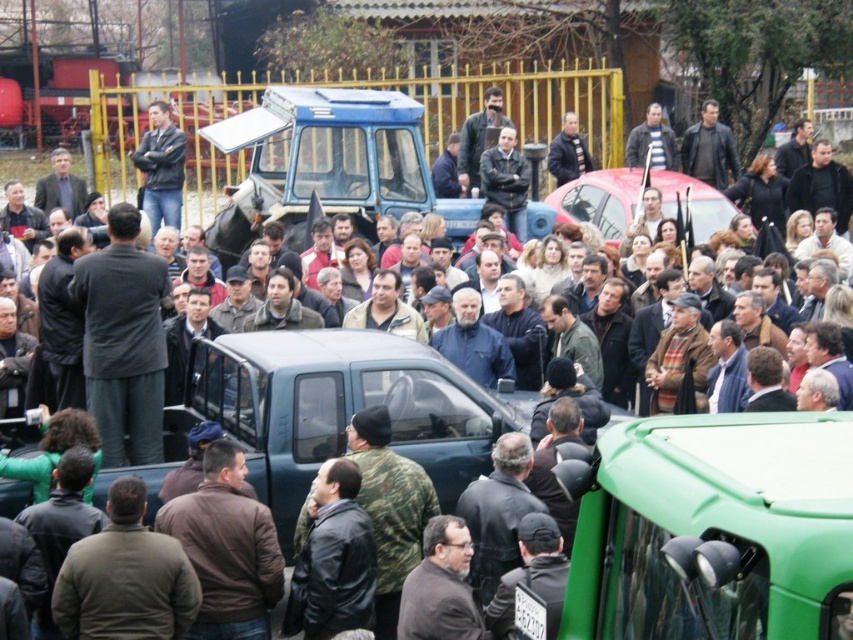
You are a photographer trying to capture both the dark brown leather jacket at upper center and the dark blue jacket at center in a single shot. Since you want to ensure both are in focus, which jacket should you prioritize focusing on first?

You should prioritize focusing on the dark brown leather jacket at upper center first because it is closer to the viewer than the dark blue jacket at center, so adjusting focus from near to far will help both be in focus.

You are standing at the point with coordinates (x=506, y=180) in the image. What object are you currently standing on?

The point at (x=506, y=180) is located on the dark brown leather jacket at center.

You are a photographer trying to capture a clear shot of the dark brown leather jacket at center and the dark brown leather jacket at upper center in the crowded scene. Which jacket should you focus on first to ensure it appears larger in your photo?

The dark brown leather jacket at upper center should be focused on first because it is larger than the dark brown leather jacket at center, ensuring it will appear bigger in the photo.